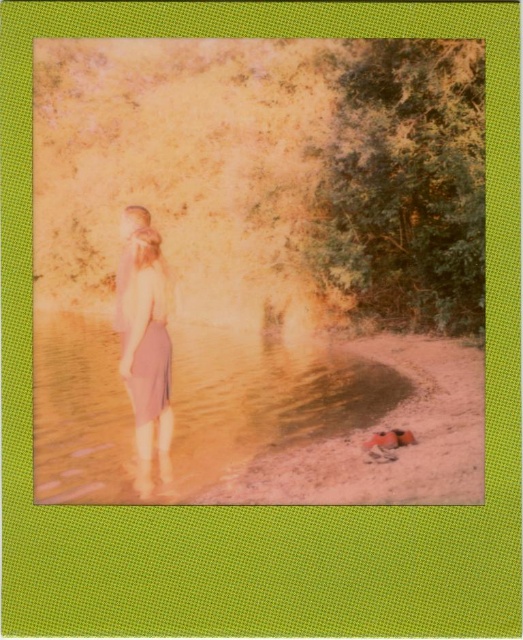
Which is behind, point (126, 301) or point (121, 352)?

The point (121, 352) is behind.

Who is shorter, pink fabric dress at center or pink satin dress at center?

pink satin dress at center is shorter.

The width and height of the screenshot is (523, 640). What do you see at coordinates (144, 342) in the screenshot?
I see `pink fabric dress at center` at bounding box center [144, 342].

You are a GUI agent. You are given a task and a screenshot of the screen. Output one action in this format:
    pyautogui.click(x=<x>, y=<y>)
    Task: Click on the pink fabric dress at center
    Image resolution: width=523 pixels, height=640 pixels.
    Given the screenshot: What is the action you would take?
    pyautogui.click(x=144, y=342)

Does smooth orange sand at lower right have a greater height compared to pink fabric dress at center?

No.

Is smooth orange sand at lower right thinner than pink fabric dress at center?

No.

Which is behind, point (445, 348) or point (167, 403)?

The point (445, 348) is behind.

The width and height of the screenshot is (523, 640). Find the location of `smooth orange sand at lower right`. smooth orange sand at lower right is located at coordinates (382, 429).

Which is below, smooth orange sand at lower right or pink satin dress at center?

smooth orange sand at lower right is lower down.

Is point (410, 417) positioned behind point (138, 381)?

That is True.

Identify the location of smooth orange sand at lower right. (382, 429).